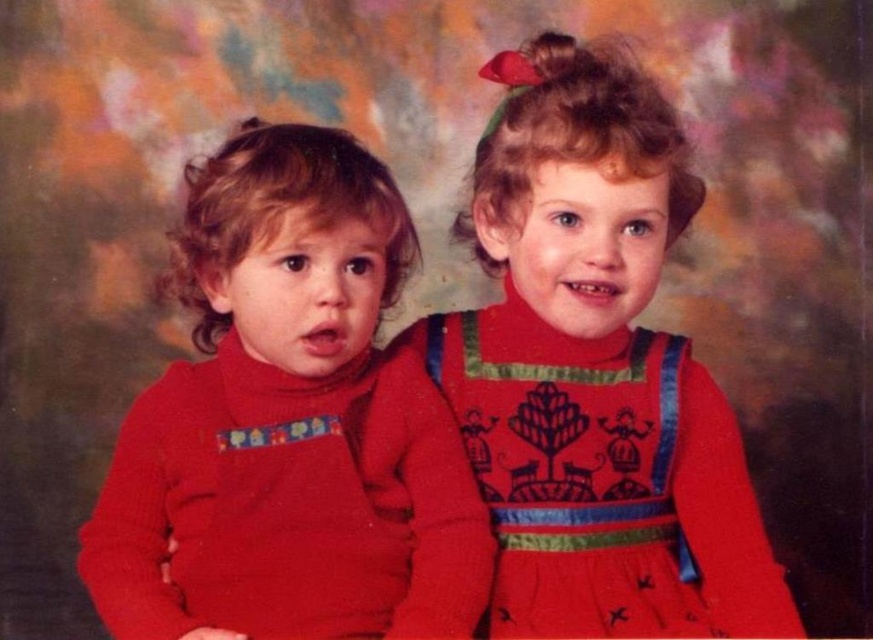
Is matte red sweater at left to the right of matte red dress at upper right from the viewer's perspective?

Incorrect, matte red sweater at left is not on the right side of matte red dress at upper right.

Does matte red sweater at left appear on the left side of matte red dress at upper right?

Yes, matte red sweater at left is to the left of matte red dress at upper right.

The width and height of the screenshot is (873, 640). In order to click on matte red sweater at left in this screenshot , I will do `click(289, 422)`.

Where is `matte red sweater at left`? The width and height of the screenshot is (873, 640). matte red sweater at left is located at coordinates (289, 422).